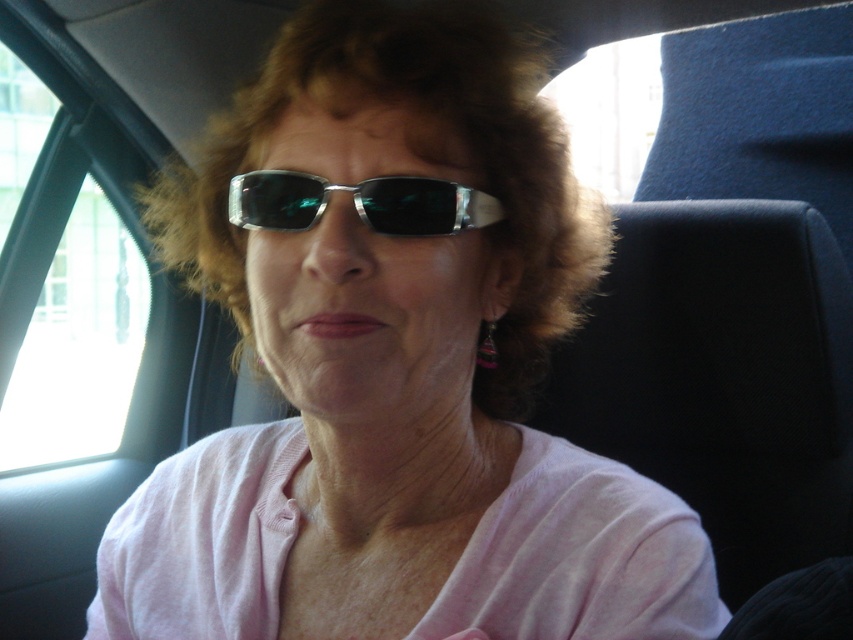
Question: Which point appears closest to the camera in this image?

Choices:
 (A) (401, 227)
 (B) (28, 109)

Answer: (A)

Question: Where is transparent glass window at upper left located in relation to metallic reflective sunglasses at center in the image?

Choices:
 (A) left
 (B) right

Answer: (A)

Question: Which object appears closest to the camera in this image?

Choices:
 (A) metallic reflective sunglasses at center
 (B) transparent glass window at upper left

Answer: (A)

Question: Which of the following is the farthest from the observer?

Choices:
 (A) (270, 177)
 (B) (90, 324)

Answer: (B)

Question: Can you confirm if transparent glass window at upper left is positioned below metallic reflective sunglasses at center?

Choices:
 (A) no
 (B) yes

Answer: (A)

Question: Is transparent glass window at upper left to the right of metallic reflective sunglasses at center from the viewer's perspective?

Choices:
 (A) yes
 (B) no

Answer: (B)